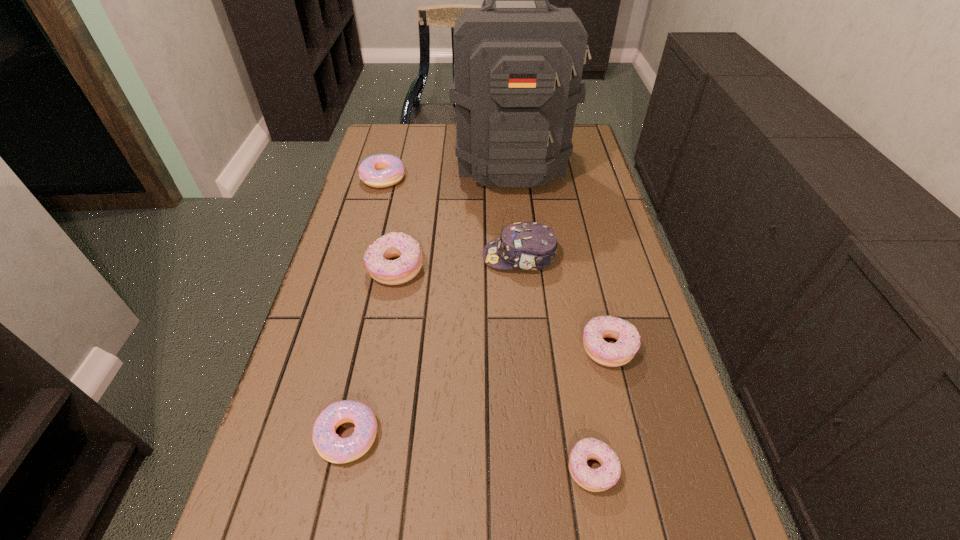
Locate an element on the screen. empty location between the headwear and the gray backpack is located at coordinates (516, 210).

The image size is (960, 540). I want to click on vacant space in between the leftmost purple doughnut and the nearest purple doughnut, so click(493, 369).

I want to click on free space that is in between the smaller pink doughnut and the smallest purple doughnut, so click(x=469, y=453).

Locate an element on the screen. vacant area between the headwear and the nearest purple doughnut is located at coordinates point(556,363).

Where is `unoccupied area between the sixth shortest object and the tallest object`? This screenshot has width=960, height=540. unoccupied area between the sixth shortest object and the tallest object is located at coordinates (516, 210).

This screenshot has height=540, width=960. What are the coordinates of `object that is the third closest one to the fifth farthest object` in the screenshot? It's located at (376, 258).

Where is `object that is the closest one to the nearest purple doughnut`? object that is the closest one to the nearest purple doughnut is located at coordinates (628, 339).

This screenshot has width=960, height=540. Identify the location of the fifth closest doughnut to the backpack. (600, 479).

The width and height of the screenshot is (960, 540). Identify the location of doughnut that is the second closest to the tallest object. (376, 258).

You are a GUI agent. You are given a task and a screenshot of the screen. Output one action in this format:
    pyautogui.click(x=<x>, y=<y>)
    Task: Click on the purple doughnut that is the third closest to the second tallest object
    The width and height of the screenshot is (960, 540).
    Given the screenshot: What is the action you would take?
    pyautogui.click(x=600, y=479)